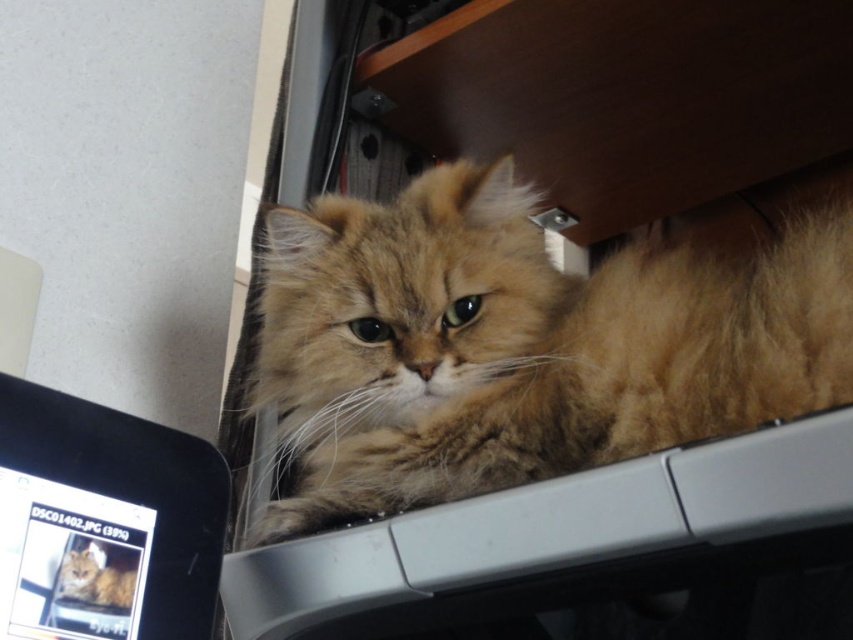
Question: From the image, what is the correct spatial relationship of matte black monitor at lower left in relation to fuzzy golden cat at upper right?

Choices:
 (A) right
 (B) left

Answer: (B)

Question: Which point is farther to the camera?

Choices:
 (A) (202, 634)
 (B) (106, 593)
 (C) (838, 314)

Answer: (A)

Question: Among these objects, which one is nearest to the camera?

Choices:
 (A) fuzzy golden cat at center
 (B) fuzzy golden cat at upper right

Answer: (B)

Question: Does fuzzy golden cat at center come in front of matte black monitor at lower left?

Choices:
 (A) no
 (B) yes

Answer: (A)

Question: Which of the following is the farthest from the observer?

Choices:
 (A) (148, 452)
 (B) (80, 566)

Answer: (A)

Question: Is fuzzy golden cat at center thinner than matte black monitor at lower left?

Choices:
 (A) no
 (B) yes

Answer: (A)